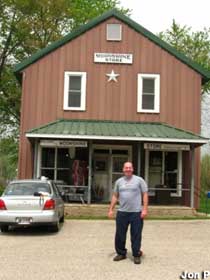
Identify the location of glass. This screenshot has width=210, height=280. (74, 166).